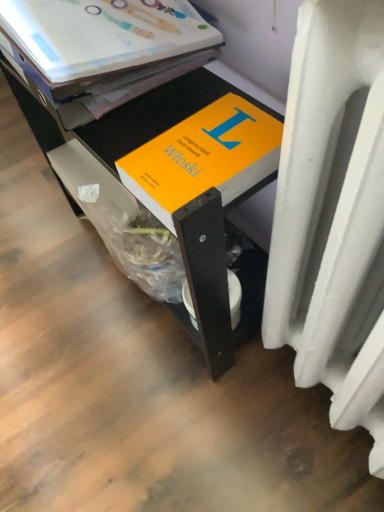
Question: Is orange matte book at center far away from orange matte book at upper center?

Choices:
 (A) no
 (B) yes

Answer: (A)

Question: Considering the relative sizes of orange matte book at center and orange matte book at upper center in the image provided, is orange matte book at center bigger than orange matte book at upper center?

Choices:
 (A) no
 (B) yes

Answer: (B)

Question: Does orange matte book at center have a greater height compared to orange matte book at upper center?

Choices:
 (A) yes
 (B) no

Answer: (A)

Question: From a real-world perspective, is orange matte book at center located beneath orange matte book at upper center?

Choices:
 (A) no
 (B) yes

Answer: (B)

Question: From a real-world perspective, is orange matte book at center physically above orange matte book at upper center?

Choices:
 (A) no
 (B) yes

Answer: (A)

Question: In terms of width, does white plastic heater at lower right look wider or thinner when compared to orange matte book at upper center?

Choices:
 (A) wide
 (B) thin

Answer: (B)

Question: From the image's perspective, is white plastic heater at lower right positioned above or below orange matte book at upper center?

Choices:
 (A) above
 (B) below

Answer: (B)

Question: Is white plastic heater at lower right in front of or behind orange matte book at upper center in the image?

Choices:
 (A) front
 (B) behind

Answer: (A)

Question: From their relative heights in the image, would you say white plastic heater at lower right is taller or shorter than orange matte book at upper center?

Choices:
 (A) short
 (B) tall

Answer: (B)

Question: Is point (183, 229) positioned closer to the camera than point (139, 26)?

Choices:
 (A) farther
 (B) closer

Answer: (B)

Question: Relative to orange matte book at upper center, is orange matte book at center in front or behind?

Choices:
 (A) front
 (B) behind

Answer: (B)

Question: Visually, is orange matte book at center positioned to the left or to the right of orange matte book at upper center?

Choices:
 (A) left
 (B) right

Answer: (B)

Question: From their relative heights in the image, would you say orange matte book at center is taller or shorter than orange matte book at upper center?

Choices:
 (A) tall
 (B) short

Answer: (A)

Question: Is orange matte book at upper center taller or shorter than orange matte book at center?

Choices:
 (A) tall
 (B) short

Answer: (B)

Question: From the image's perspective, is orange matte book at upper center above or below orange matte book at center?

Choices:
 (A) above
 (B) below

Answer: (A)